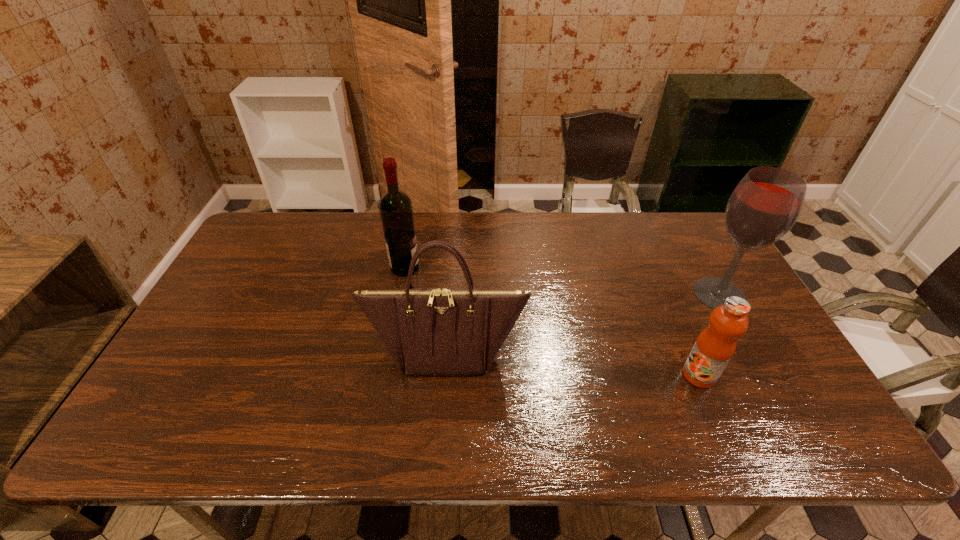
At what (x,y) coordinates should I click in order to perform the action: click on free spot located 0.320m on the front label of the fruit juice. Please return your answer as a coordinate pair (x, y). The image size is (960, 540). Looking at the image, I should click on (555, 375).

Identify the location of object located at the right edge. (766, 203).

You are a GUI agent. You are given a task and a screenshot of the screen. Output one action in this format:
    pyautogui.click(x=<x>, y=<y>)
    Task: Click on the vacant point at the far edge
    The image size is (960, 540).
    Given the screenshot: What is the action you would take?
    pyautogui.click(x=556, y=215)

Locate an element on the screen. This screenshot has width=960, height=540. free space at the near edge is located at coordinates (707, 436).

What are the coordinates of `free location at the left edge of the desktop` in the screenshot? It's located at (275, 277).

This screenshot has width=960, height=540. Identify the location of vacant position at the right edge of the desktop. (694, 279).

Find the location of a particular element. The width and height of the screenshot is (960, 540). vacant area at the far left corner is located at coordinates (300, 213).

The width and height of the screenshot is (960, 540). In order to click on vacant space at the near left corner in this screenshot , I will do `click(137, 428)`.

Image resolution: width=960 pixels, height=540 pixels. In order to click on free space between the left alcohol and the third object from left to right in this screenshot , I will do [552, 321].

Locate an element on the screen. The image size is (960, 540). free space between the shortest object and the left alcohol is located at coordinates (552, 321).